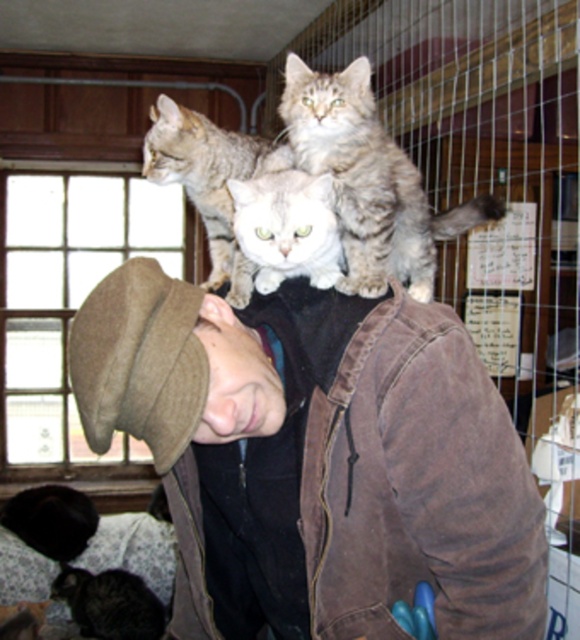
Between brown suede jacket at center and tabby fur cat at center, which one appears on the right side from the viewer's perspective?

From the viewer's perspective, tabby fur cat at center appears more on the right side.

In the scene shown: Does brown suede jacket at center have a lesser width compared to tabby fur cat at center?

In fact, brown suede jacket at center might be wider than tabby fur cat at center.

Is point (125, 404) less distant than point (392, 154)?

Yes, it is.

Identify the location of brown suede jacket at center. The image size is (580, 640). (317, 458).

Is brown suede jacket at center further to camera compared to black fur head at lower left?

That is False.

Can you confirm if brown suede jacket at center is taller than black fur head at lower left?

Yes.

Find the location of a particular element. Image resolution: width=580 pixels, height=640 pixels. brown suede jacket at center is located at coordinates (317, 458).

Which is behind, point (327, 93) or point (39, 548)?

Positioned behind is point (39, 548).

Can you confirm if tabby fur cat at center is thinner than black fur head at lower left?

Incorrect, tabby fur cat at center's width is not less than black fur head at lower left's.

This screenshot has height=640, width=580. I want to click on tabby fur cat at center, so click(369, 180).